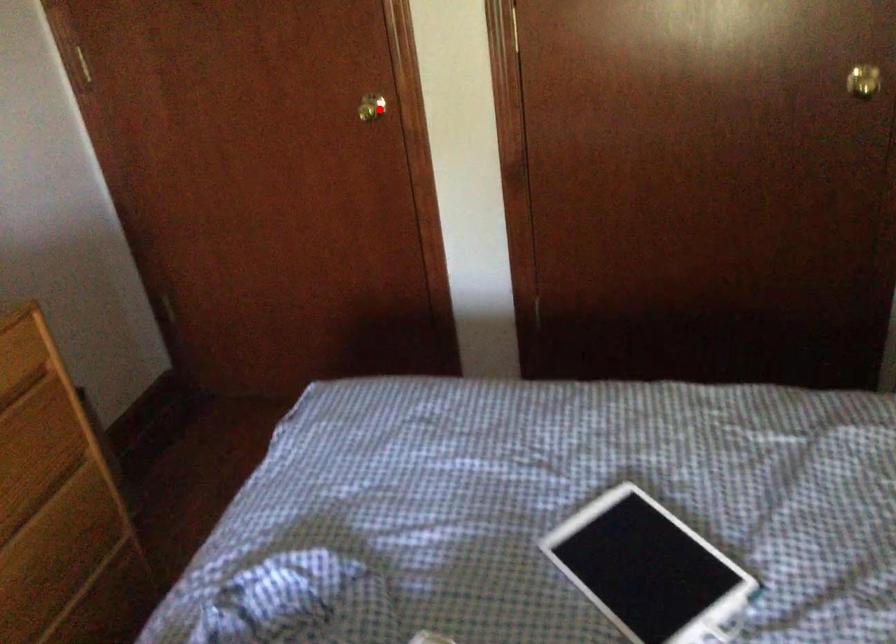
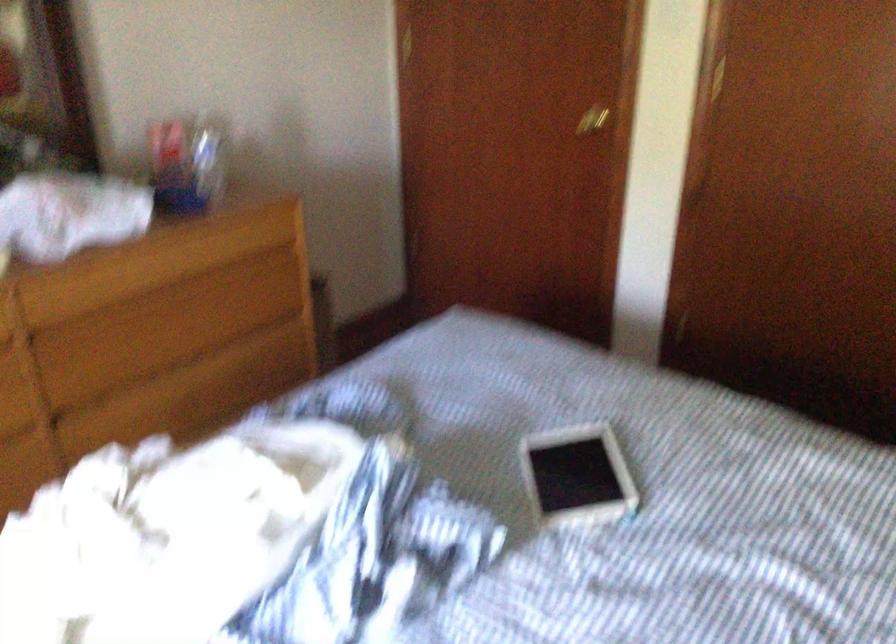
Question: I am providing you with two images of the same scene from different viewpoints. Given a red point in image1, look at the same physical point in image2. Is it:

Choices:
 (A) Closer to the viewpoint
 (B) Farther from the viewpoint

Answer: (B)